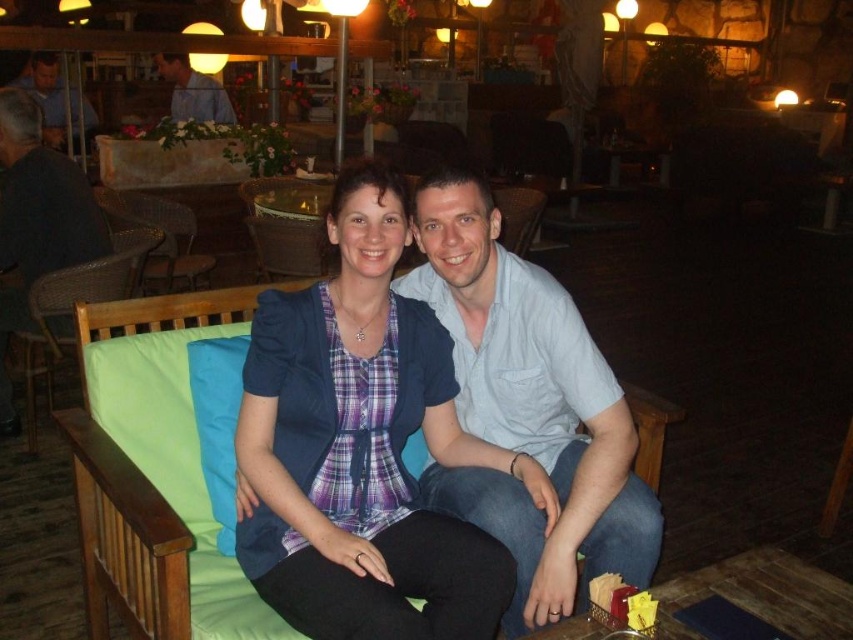
You are a photographer setting up a shoot in this cozy indoor setting. You need to position a 1.5m tall tripod between the light blue cotton shirt at center and the dark gray fabric chair at left. Can the tripod fit vertically between them without touching either object?

The light blue cotton shirt at center is shorter than the dark gray fabric chair at left. Since the tripod is 1.5m tall, it can be placed between them vertically as long as there is enough horizontal space, but the description does not provide information about the horizontal distance between the objects.

You are standing in the restaurant and want to take a photo of both the point at coordinates (485, 230) and the point at coordinates (30, 236). Which point should you focus on first to ensure both are in clear view?

You should focus on point (485, 230) first because it is closer to the camera than point (30, 236). This ensures both points are in focus as the depth of field will cover the farther point once the closer one is sharp.